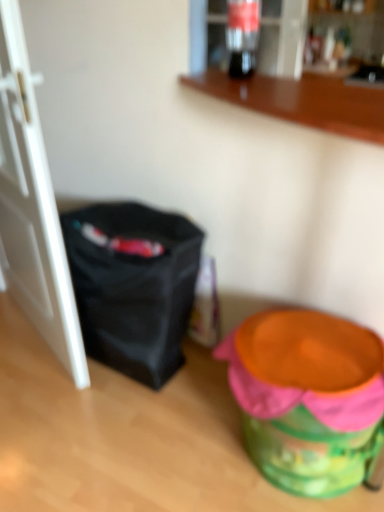
Question: Does white matte door at left come behind black fabric bag at left?

Choices:
 (A) yes
 (B) no

Answer: (B)

Question: Considering the relative positions of white matte door at left and black fabric bag at left in the image provided, is white matte door at left to the right of black fabric bag at left from the viewer's perspective?

Choices:
 (A) no
 (B) yes

Answer: (A)

Question: From a real-world perspective, is white matte door at left on top of black fabric bag at left?

Choices:
 (A) no
 (B) yes

Answer: (B)

Question: Is white matte door at left located outside black fabric bag at left?

Choices:
 (A) yes
 (B) no

Answer: (A)

Question: Is black fabric bag at left located within white matte door at left?

Choices:
 (A) yes
 (B) no

Answer: (B)

Question: Does white matte door at left have a larger size compared to black fabric bag at left?

Choices:
 (A) no
 (B) yes

Answer: (B)

Question: Considering the relative positions of wooden counter at upper center and orange plastic potty at lower right in the image provided, is wooden counter at upper center in front of orange plastic potty at lower right?

Choices:
 (A) no
 (B) yes

Answer: (B)

Question: Can you confirm if wooden counter at upper center is thinner than orange plastic potty at lower right?

Choices:
 (A) yes
 (B) no

Answer: (B)

Question: Is wooden counter at upper center in contact with orange plastic potty at lower right?

Choices:
 (A) no
 (B) yes

Answer: (A)

Question: From a real-world perspective, is wooden counter at upper center over orange plastic potty at lower right?

Choices:
 (A) no
 (B) yes

Answer: (B)

Question: Can you confirm if wooden counter at upper center is positioned to the left of orange plastic potty at lower right?

Choices:
 (A) yes
 (B) no

Answer: (A)

Question: Does wooden counter at upper center lie behind orange plastic potty at lower right?

Choices:
 (A) no
 (B) yes

Answer: (A)

Question: Considering the relative positions of translucent glass soda at upper center and wooden counter at upper center in the image provided, is translucent glass soda at upper center behind wooden counter at upper center?

Choices:
 (A) no
 (B) yes

Answer: (B)